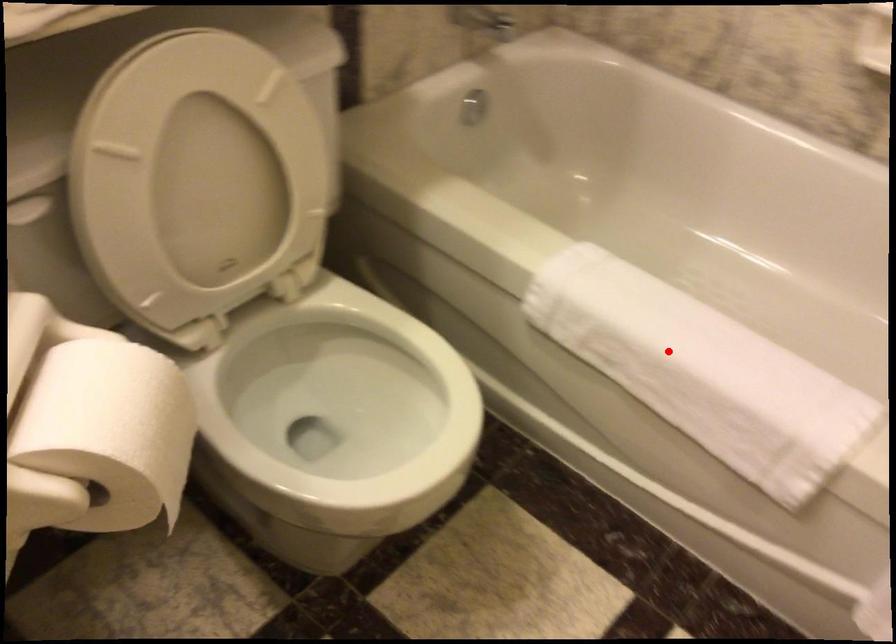
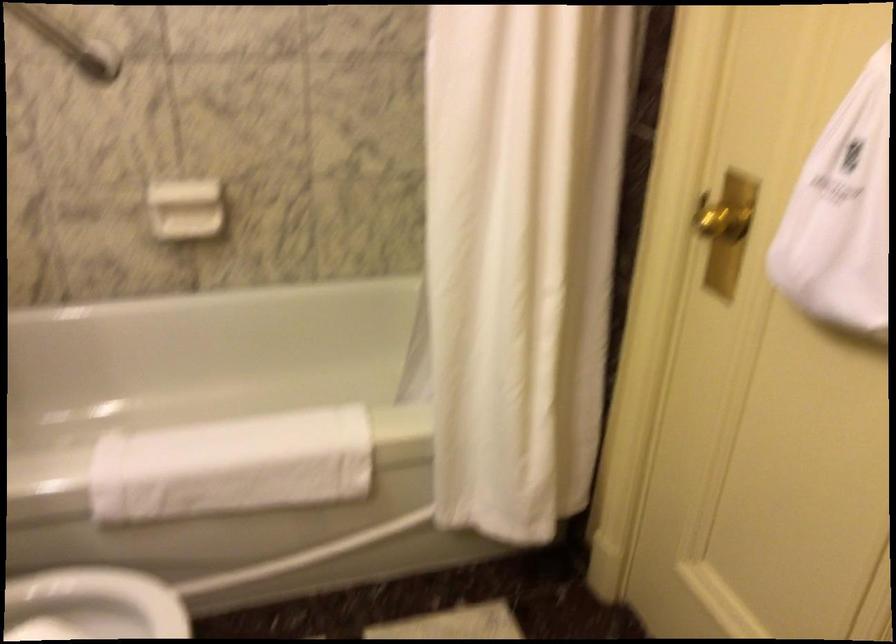
The point at the highlighted location is marked in the first image. Where is the corresponding point in the second image?

(231, 466)